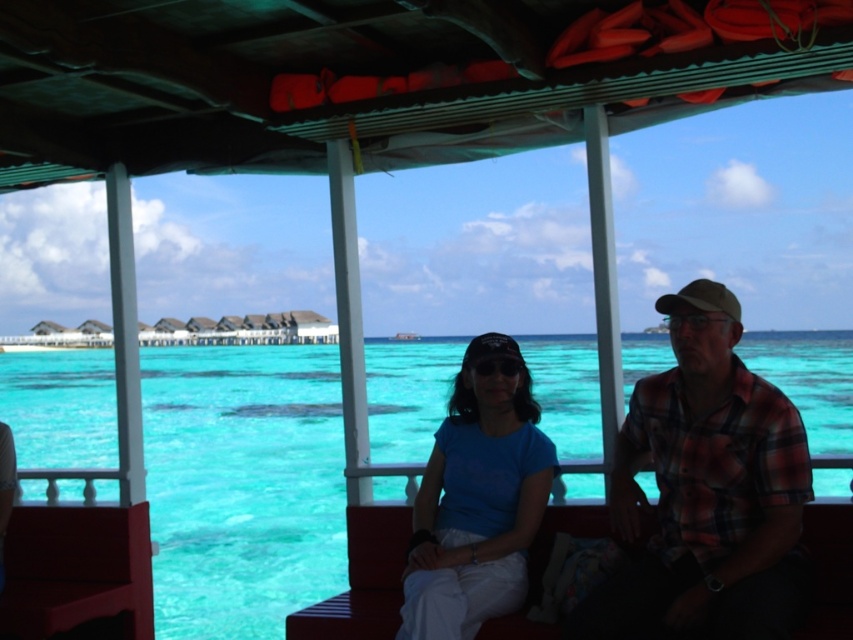
You are a photographer on the boat and want to capture the plaid fabric shirt at right and the turquoise clear water at center in the same frame. Which object should you focus on first if you want to ensure both are in focus?

The plaid fabric shirt at right is closer to you than the turquoise clear water at center, so you should focus on the plaid fabric shirt at right first to ensure both are in focus.

Looking at this image, you are a photographer on the boat and want to take a photo of the plaid fabric shirt at right without the turquoise clear water at center blocking the view. Is this possible based on their positions?

The plaid fabric shirt at right is behind the turquoise clear water at center, so taking a photo of the plaid fabric shirt at right without the turquoise clear water at center blocking the view is not possible because the shirt is positioned behind the water.